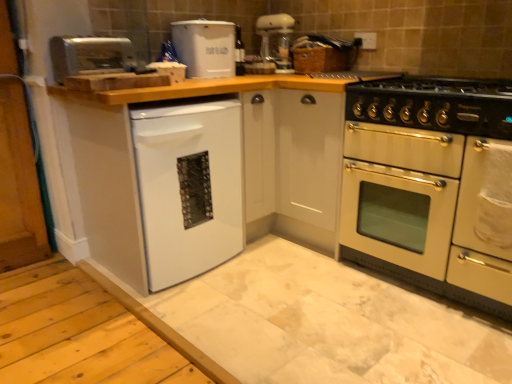
Question: Is white matte dishwasher at lower left bigger than black enamel gas stove at right?

Choices:
 (A) no
 (B) yes

Answer: (B)

Question: Is white matte dishwasher at lower left not close to black enamel gas stove at right?

Choices:
 (A) no
 (B) yes

Answer: (A)

Question: Is white matte dishwasher at lower left positioned beyond the bounds of black enamel gas stove at right?

Choices:
 (A) yes
 (B) no

Answer: (A)

Question: Is white matte dishwasher at lower left oriented away from black enamel gas stove at right?

Choices:
 (A) no
 (B) yes

Answer: (A)

Question: Is white matte dishwasher at lower left surrounding black enamel gas stove at right?

Choices:
 (A) no
 (B) yes

Answer: (A)

Question: Is white matte dishwasher at lower left directly adjacent to black enamel gas stove at right?

Choices:
 (A) yes
 (B) no

Answer: (B)

Question: Does satin silver toaster at upper left, the first appliance viewed from the front, turn towards white plastic bread bin at upper center, the 2th appliance from the left?

Choices:
 (A) no
 (B) yes

Answer: (A)

Question: Does satin silver toaster at upper left, which ranks as the 2th appliance in right-to-left order, come in front of white plastic bread bin at upper center, the 2th appliance from the left?

Choices:
 (A) no
 (B) yes

Answer: (B)

Question: From a real-world perspective, is satin silver toaster at upper left, which ranks as the 2th appliance in back-to-front order, positioned under white plastic bread bin at upper center, marked as the first appliance in a back-to-front arrangement, based on gravity?

Choices:
 (A) no
 (B) yes

Answer: (B)

Question: Does satin silver toaster at upper left, the first appliance viewed from the front, have a greater height compared to white plastic bread bin at upper center, the 2th appliance from the left?

Choices:
 (A) yes
 (B) no

Answer: (B)

Question: Is satin silver toaster at upper left, the first appliance viewed from the front, positioned far away from white plastic bread bin at upper center, marked as the first appliance in a back-to-front arrangement?

Choices:
 (A) no
 (B) yes

Answer: (A)

Question: Is satin silver toaster at upper left, which ranks as the 2th appliance in right-to-left order, wider than white plastic bread bin at upper center, the 2th appliance from the left?

Choices:
 (A) yes
 (B) no

Answer: (A)

Question: Is satin silver toaster at upper left, which ranks as the 2th appliance in right-to-left order, to the left of white glossy dishwasher at lower left from the viewer's perspective?

Choices:
 (A) no
 (B) yes

Answer: (B)